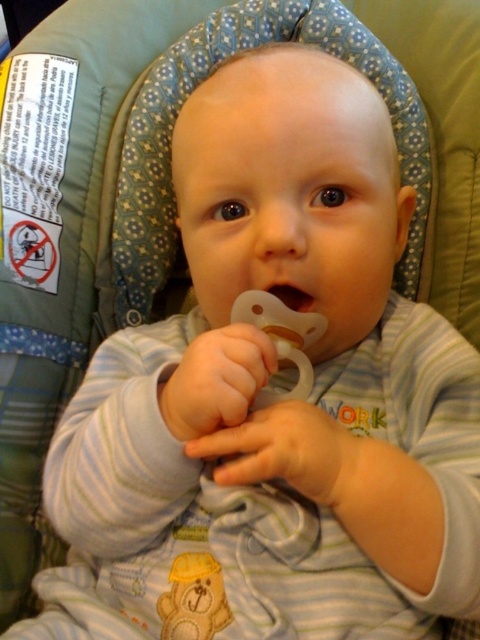
Question: Is the position of yellow fabric teddy bear at center less distant than that of clear plastic pacifier at center?

Choices:
 (A) yes
 (B) no

Answer: (A)

Question: Is yellow fabric teddy bear at center above clear plastic pacifier at center?

Choices:
 (A) no
 (B) yes

Answer: (A)

Question: Does yellow fabric teddy bear at center appear on the right side of clear plastic pacifier at center?

Choices:
 (A) yes
 (B) no

Answer: (B)

Question: Which point is closer to the camera?

Choices:
 (A) (211, 604)
 (B) (289, 289)

Answer: (A)